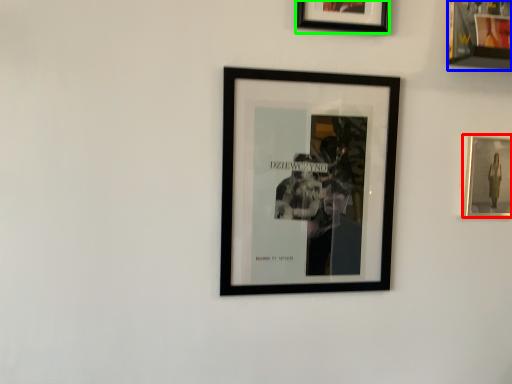
Question: Estimate the real-world distances between objects in this image. Which object is closer to picture frame (highlighted by a red box), picture frame (highlighted by a blue box) or picture frame (highlighted by a green box)?

Choices:
 (A) picture frame
 (B) picture frame

Answer: (A)